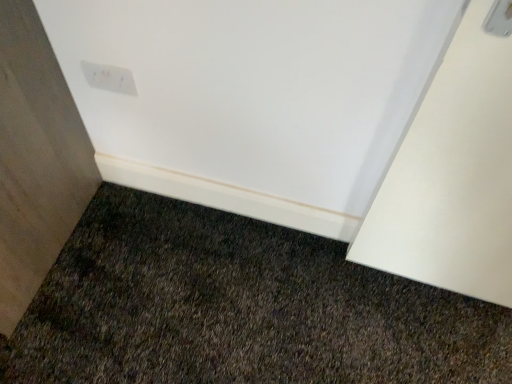
Locate an element on the screen. white plastic light switch at upper center is located at coordinates (109, 78).

The width and height of the screenshot is (512, 384). What do you see at coordinates (109, 78) in the screenshot? I see `white plastic light switch at upper center` at bounding box center [109, 78].

Find the location of `white plastic light switch at upper center`. white plastic light switch at upper center is located at coordinates (109, 78).